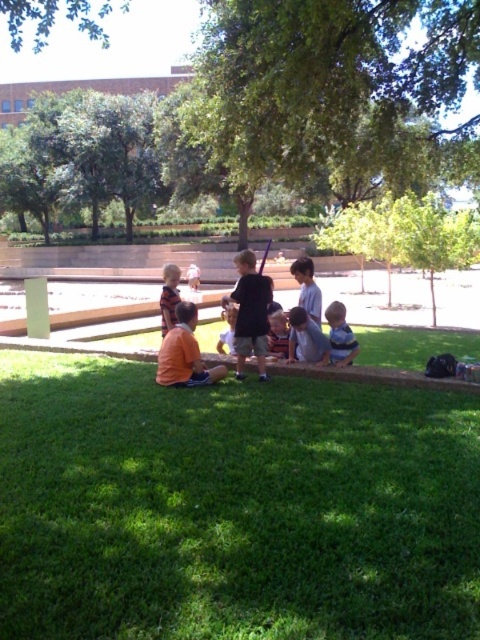
Question: Does green grass at lower center appear on the left side of light blue shirt at center?

Choices:
 (A) yes
 (B) no

Answer: (A)

Question: Among these points, which one is nearest to the camera?

Choices:
 (A) (156, 381)
 (B) (339, 353)
 (C) (176, 296)

Answer: (A)

Question: Is black cotton shirt at center closer to the viewer compared to blue striped shirt at lower right?

Choices:
 (A) yes
 (B) no

Answer: (A)

Question: Considering the relative positions of light blue denim jacket at center and striped sweater at center in the image provided, where is light blue denim jacket at center located with respect to striped sweater at center?

Choices:
 (A) below
 (B) above

Answer: (A)

Question: Which object appears farthest from the camera in this image?

Choices:
 (A) green grass at lower center
 (B) orange cotton shirt at lower left
 (C) light blue shirt at center

Answer: (C)

Question: Which of the following is the closest to the observer?

Choices:
 (A) (339, 349)
 (B) (277, 346)

Answer: (A)